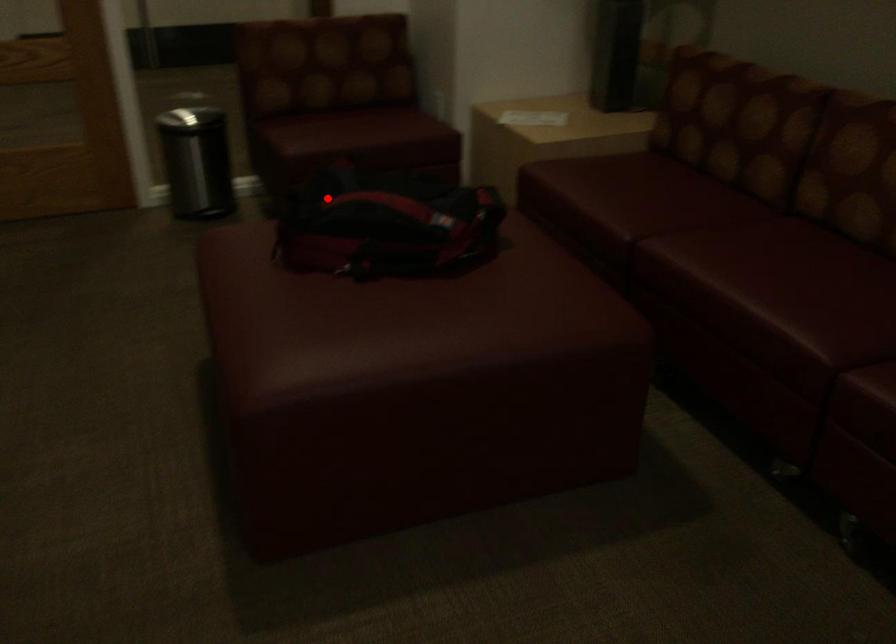
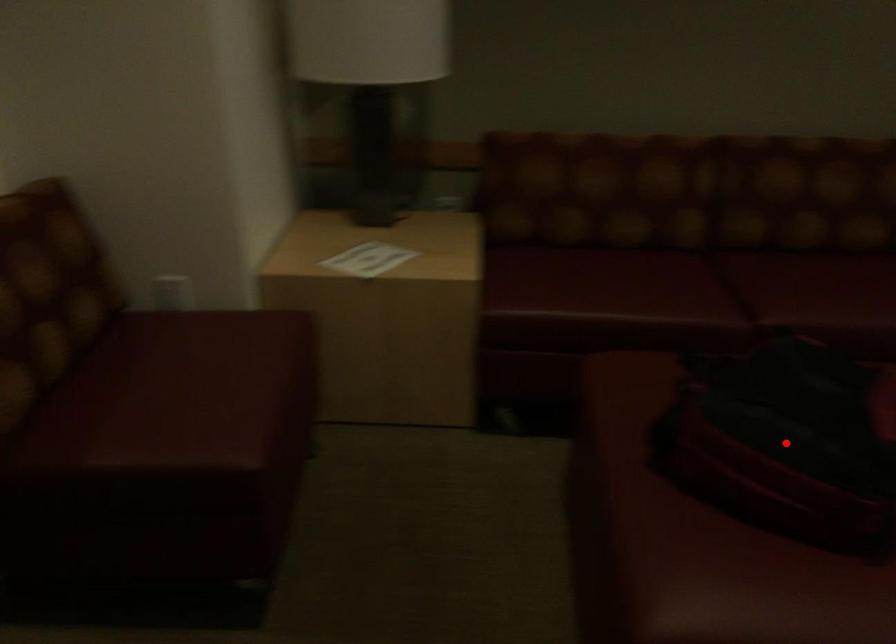
I am providing you with two images of the same scene from different viewpoints. A red point is marked on the first image and another point is marked on the second image. Do the highlighted points in image1 and image2 indicate the same real-world spot?

Yes